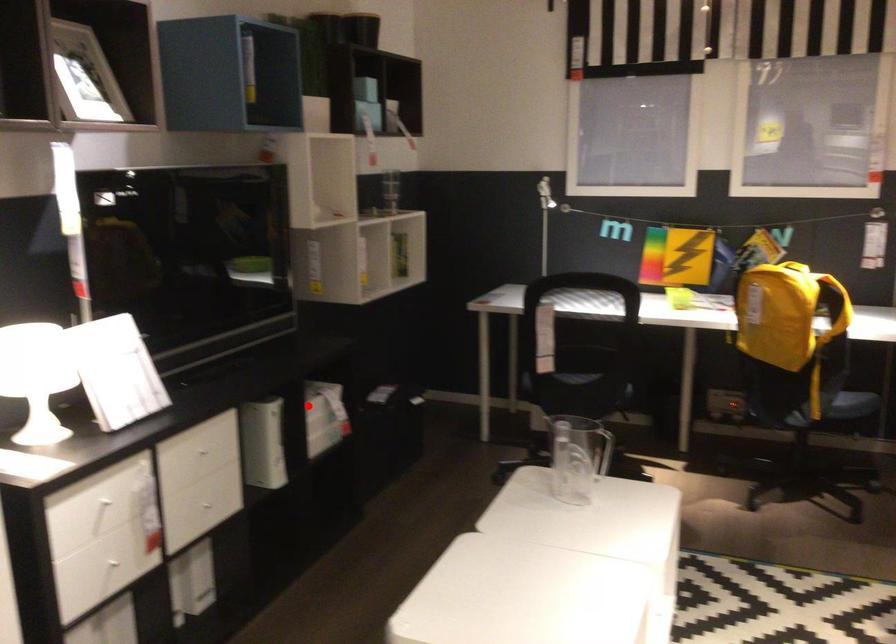
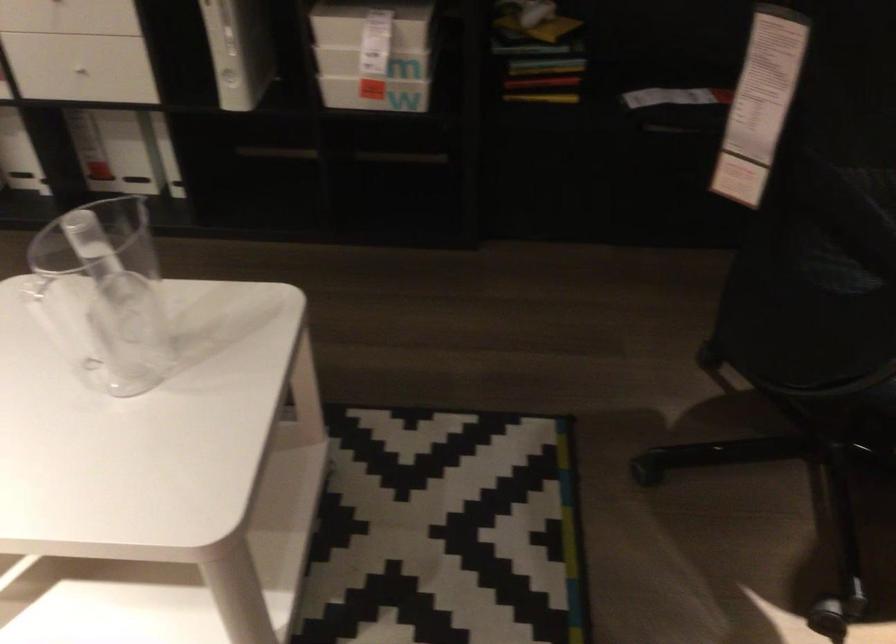
Question: I am providing you with two images of the same scene from different viewpoints. A red point is shown in image1. For the corresponding object point in image2, is it positioned nearer or farther from the camera?

Choices:
 (A) Nearer
 (B) Farther

Answer: (A)